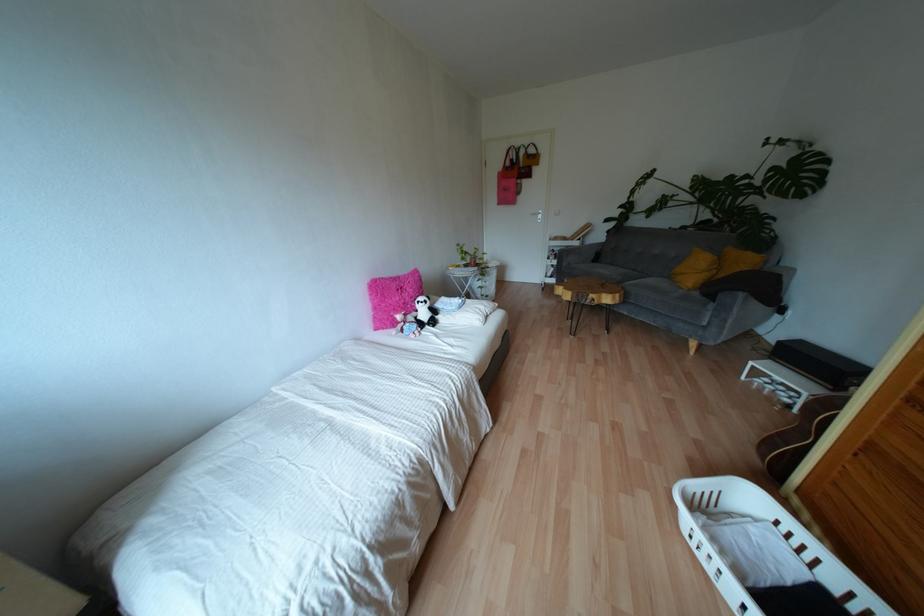
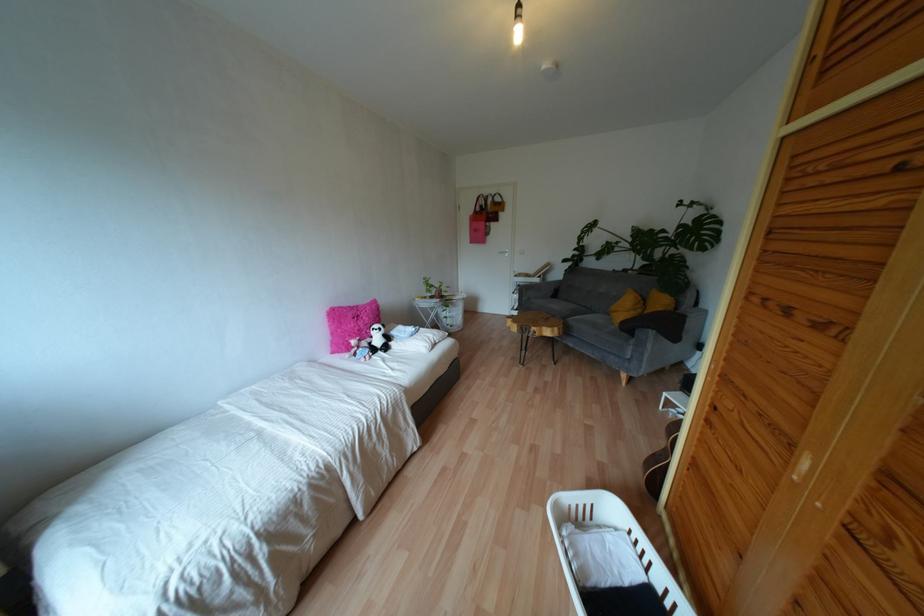
Where in the second image is the point corresponding to point 485,296 from the first image?

(450, 325)